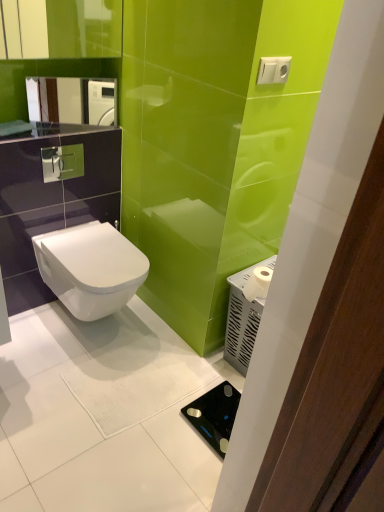
Question: Is white matte toilet paper at right bigger or smaller than white glossy toilet at center?

Choices:
 (A) small
 (B) big

Answer: (A)

Question: From a real-world perspective, is white matte toilet paper at right positioned above or below white glossy toilet at center?

Choices:
 (A) above
 (B) below

Answer: (A)

Question: Estimate the real-world distances between objects in this image. Which object is farther from the black glass scale at lower right?

Choices:
 (A) white glossy toilet at center
 (B) white matte toilet paper at right

Answer: (A)

Question: Which object is the farthest from the white glossy toilet at center?

Choices:
 (A) white matte toilet paper at right
 (B) black glass scale at lower right

Answer: (B)